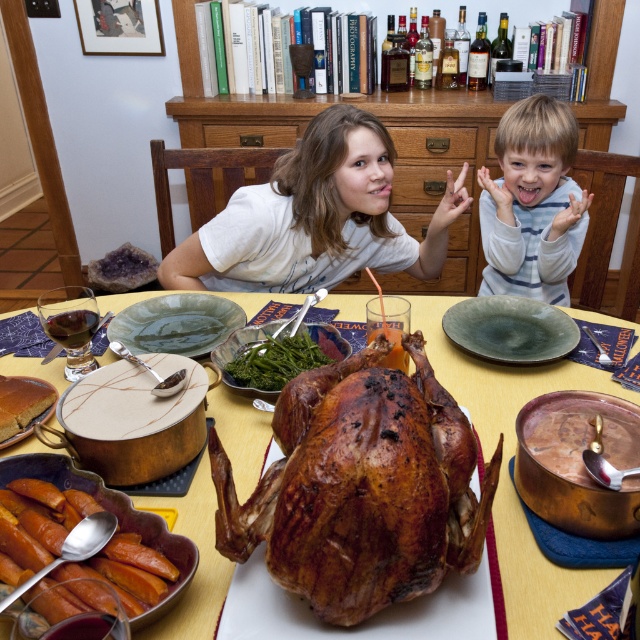
Question: Which object appears closest to the camera in this image?

Choices:
 (A) shiny copper pot at center
 (B) green matte platter at center
 (C) light brown striped shirt at upper right
 (D) golden brown roasted turkey at center

Answer: (D)

Question: Can you confirm if golden brown roasted turkey at center is positioned below green leafy vegetables at center?

Choices:
 (A) no
 (B) yes

Answer: (B)

Question: Is the position of green leafy vegetables at center less distant than that of golden brown flan at center?

Choices:
 (A) no
 (B) yes

Answer: (A)

Question: Which object is the closest to the green matte platter at center?

Choices:
 (A) light brown striped shirt at upper right
 (B) shiny copper pot at center

Answer: (B)

Question: Does green ceramic platter at center have a greater width compared to green leafy vegetables at center?

Choices:
 (A) yes
 (B) no

Answer: (A)

Question: Which point is closer to the camera?

Choices:
 (A) (125, 321)
 (B) (266, 509)
 (C) (541, 579)

Answer: (B)